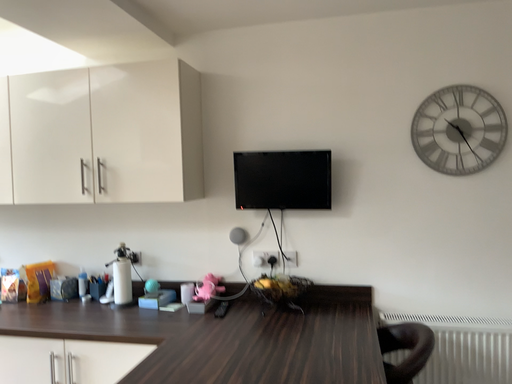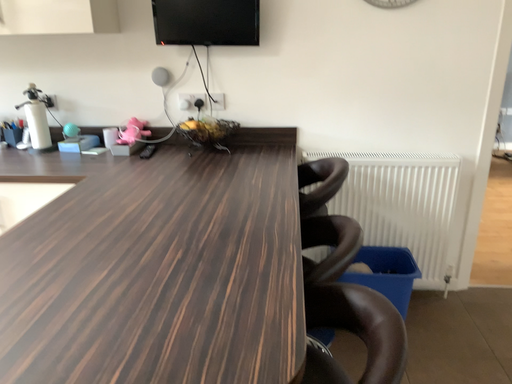
Question: Which way did the camera rotate in the video?

Choices:
 (A) rotated right
 (B) rotated left

Answer: (A)